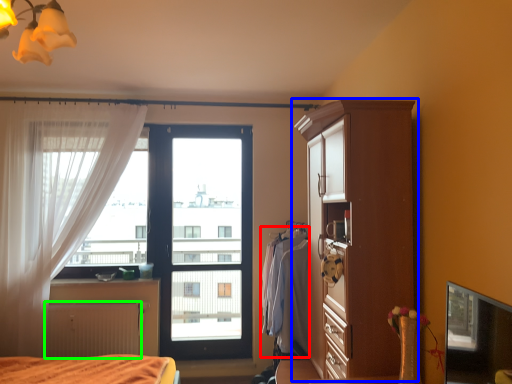
Question: Estimate the real-world distances between objects in this image. Which object is closer to clothing (highlighted by a red box), cupboard (highlighted by a blue box) or radiator (highlighted by a green box)?

Choices:
 (A) cupboard
 (B) radiator

Answer: (A)